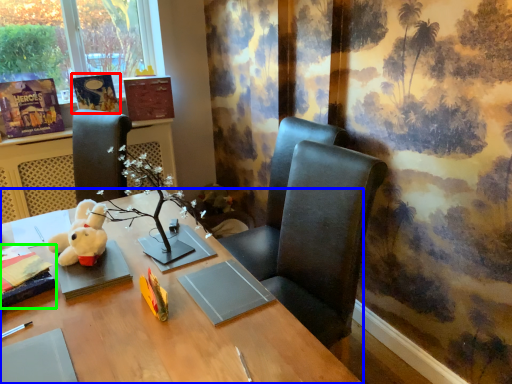
Question: Considering the real-world distances, which object is closest to book (highlighted by a red box)? desk (highlighted by a blue box) or book (highlighted by a green box).

Choices:
 (A) desk
 (B) book

Answer: (B)